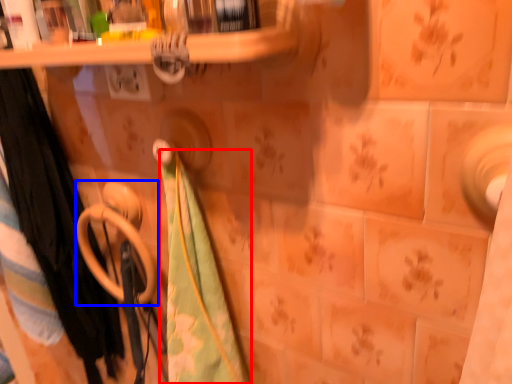
Question: Which object is further to the camera taking this photo, beach towel (highlighted by a red box) or towel rack (highlighted by a blue box)?

Choices:
 (A) beach towel
 (B) towel rack

Answer: (B)